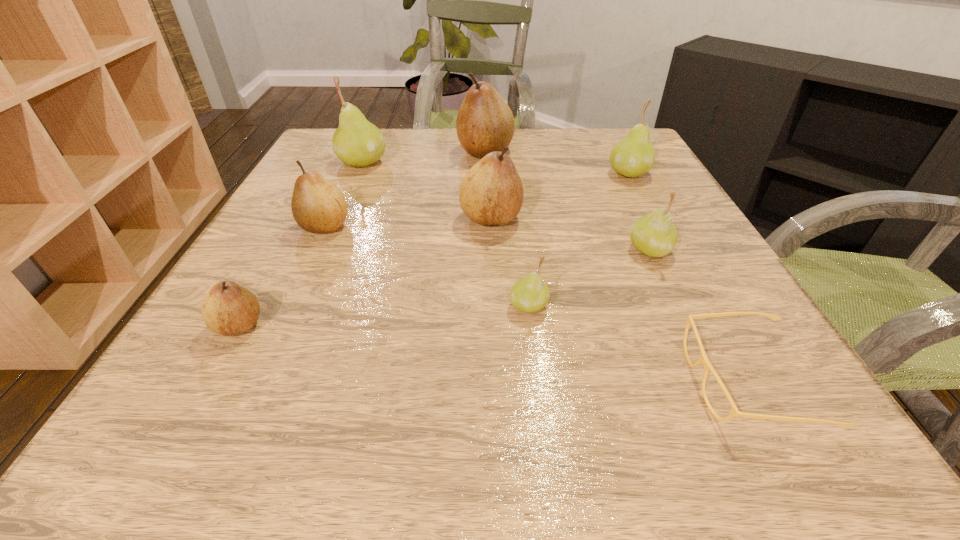
In the image, there is a desktop. At what (x,y) coordinates should I click in order to perform the action: click on vacant space at the right edge. Please return your answer as a coordinate pair (x, y). This screenshot has width=960, height=540. Looking at the image, I should click on (623, 208).

In the image, there is a desktop. Where is `free space at the far left corner`? free space at the far left corner is located at coordinates (306, 166).

Locate an element on the screen. blank region between the smallest green pear and the biggest brown pear is located at coordinates (507, 229).

This screenshot has height=540, width=960. Identify the location of free space between the third smallest green pear and the third biggest green pear. (639, 212).

Find the location of a particular element. The height and width of the screenshot is (540, 960). vacant space in between the biggest brown pear and the second biggest green pear is located at coordinates (557, 163).

Find the location of `free space between the second biggest green pear and the farthest brown pear`. free space between the second biggest green pear and the farthest brown pear is located at coordinates (557, 163).

Locate an element on the screen. Image resolution: width=960 pixels, height=540 pixels. unoccupied area between the biggest brown pear and the beige spectacles is located at coordinates (616, 267).

Find the location of a particular element. This screenshot has height=540, width=960. free space between the biggest brown pear and the second smallest brown pear is located at coordinates (405, 189).

The image size is (960, 540). What are the coordinates of `free space between the second biggest green pear and the farthest brown pear` in the screenshot? It's located at (557, 163).

Find the location of a particular element. This screenshot has width=960, height=540. vacant area between the third biggest brown pear and the nearest brown pear is located at coordinates (281, 276).